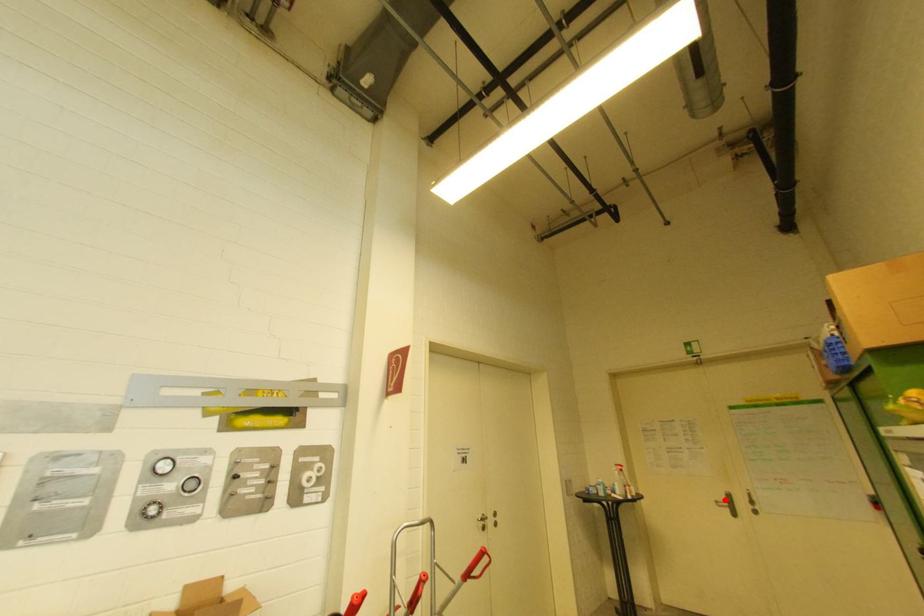
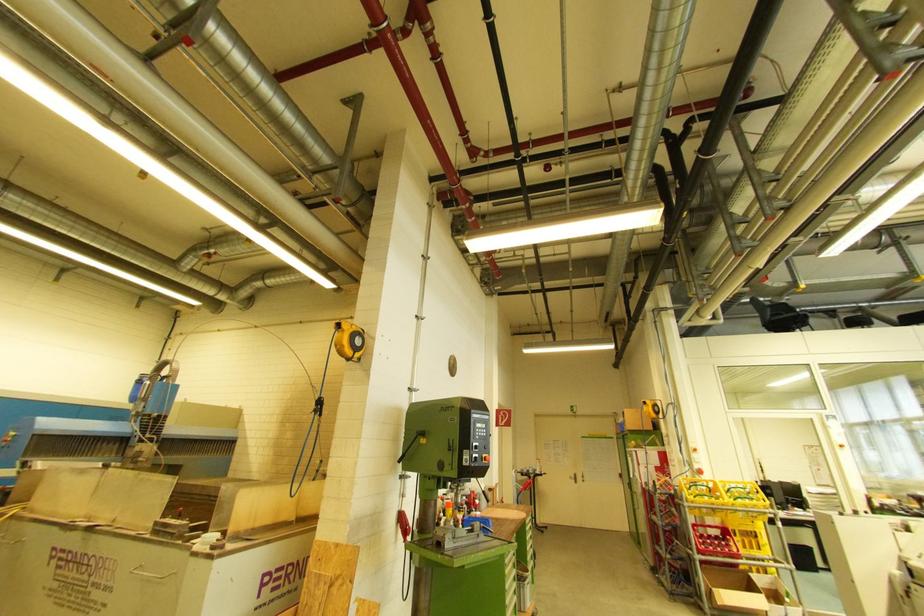
Question: I am providing you with two images of the same scene from different viewpoints. Given a red point in image1, look at the same physical point in image2. Is it:

Choices:
 (A) Closer to the viewpoint
 (B) Farther from the viewpoint

Answer: (B)